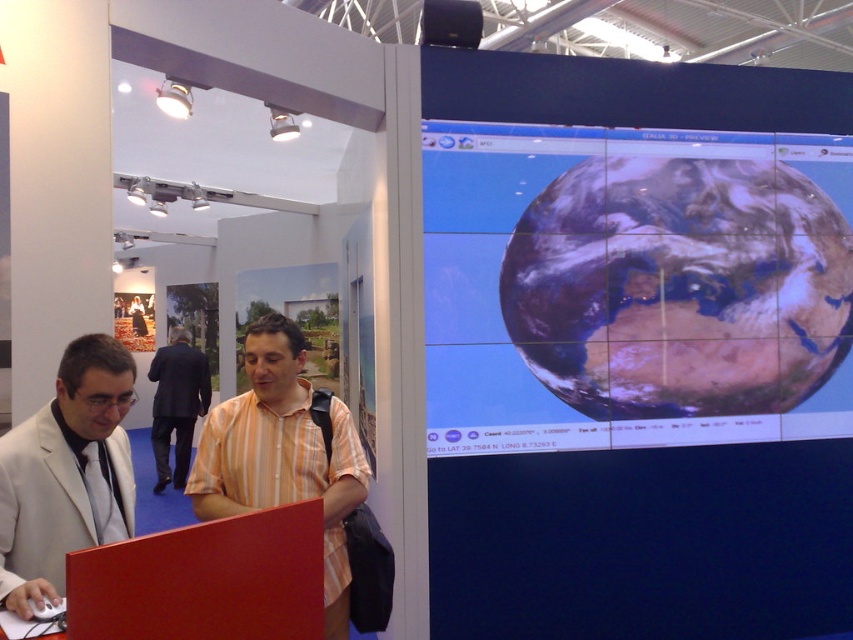
Does smooth glossy earth at right appear over matte white suit at left?

Yes.

Is point (646, 364) more distant than point (90, 435)?

Yes, it is behind point (90, 435).

You are a GUI agent. You are given a task and a screenshot of the screen. Output one action in this format:
    pyautogui.click(x=<x>, y=<y>)
    Task: Click on the smooth glossy earth at right
    
    Given the screenshot: What is the action you would take?
    pyautogui.click(x=679, y=285)

Between orange striped shirt at center and dark suit at center, which one appears on the right side from the viewer's perspective?

From the viewer's perspective, orange striped shirt at center appears more on the right side.

In the scene shown: Can you confirm if orange striped shirt at center is positioned to the left of dark suit at center?

In fact, orange striped shirt at center is to the right of dark suit at center.

Where is `orange striped shirt at center`? The image size is (853, 640). orange striped shirt at center is located at coordinates (282, 454).

This screenshot has height=640, width=853. I want to click on orange striped shirt at center, so click(282, 454).

This screenshot has width=853, height=640. Find the location of `matte white suit at left`. matte white suit at left is located at coordinates (67, 474).

Consider the image. Does matte white suit at left come behind dark suit at center?

That is False.

Is point (56, 509) closer to viewer compared to point (167, 468)?

Yes, point (56, 509) is in front of point (167, 468).

At what (x,y) coordinates should I click in order to perform the action: click on matte white suit at left. Please return your answer as a coordinate pair (x, y). Looking at the image, I should click on (67, 474).